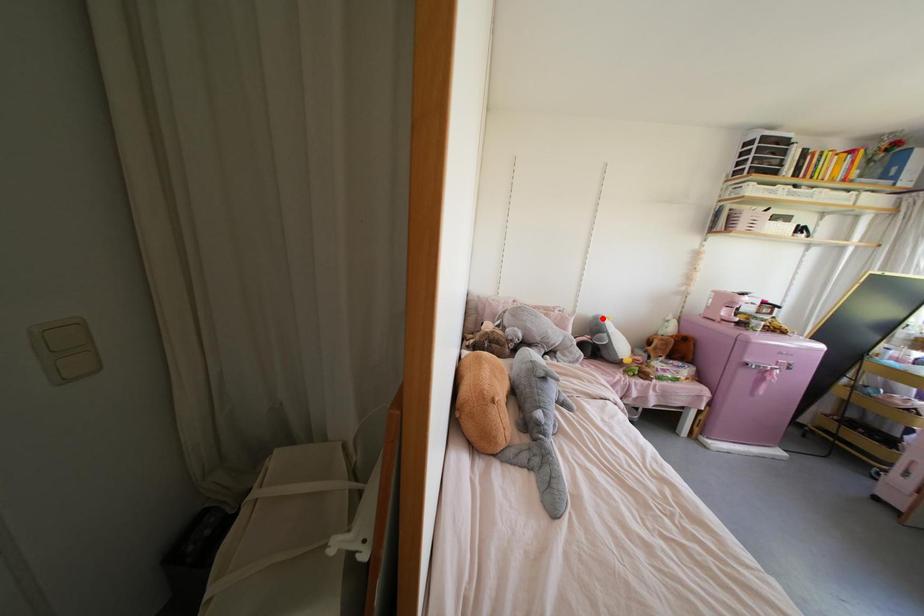
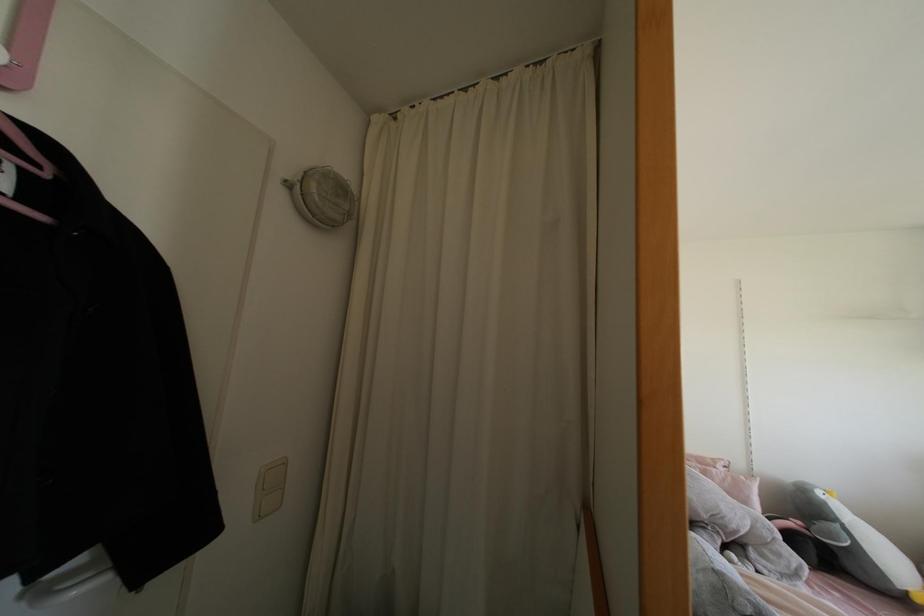
Question: I am providing you with two images of the same scene from different viewpoints. A red point is shown in image1. For the corresponding object point in image2, is it positioned nearer or farther from the camera?

Choices:
 (A) Nearer
 (B) Farther

Answer: (A)